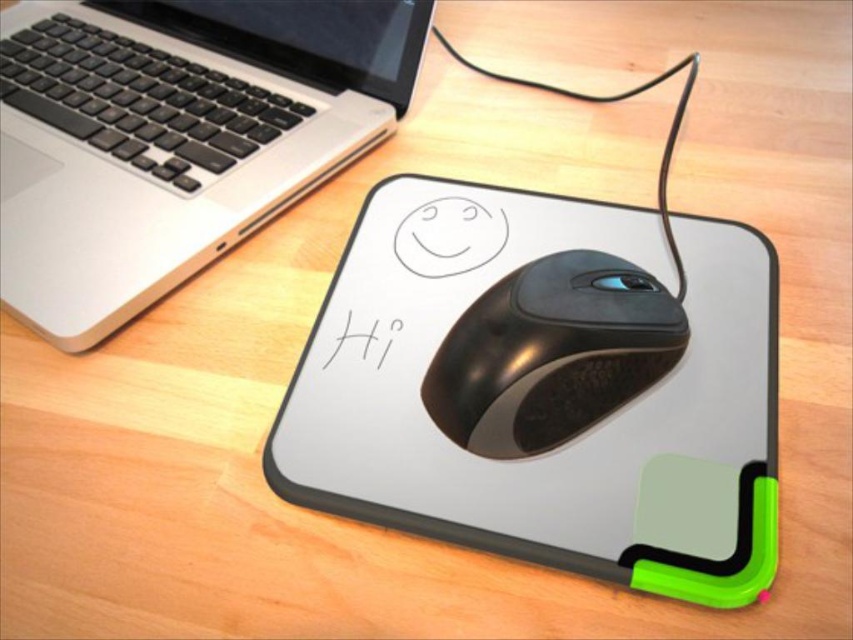
Question: Does white matte mousepad at center have a smaller size compared to satin silver laptop at upper left?

Choices:
 (A) yes
 (B) no

Answer: (A)

Question: Which object is positioned farthest from the white matte mousepad at center?

Choices:
 (A) satin silver laptop at upper left
 (B) black matte mouse at center

Answer: (A)

Question: Does white matte mousepad at center have a lesser width compared to black matte mouse at center?

Choices:
 (A) no
 (B) yes

Answer: (A)

Question: Which point is farther to the camera?

Choices:
 (A) satin silver laptop at upper left
 (B) white matte mousepad at center
 (C) black matte mouse at center

Answer: (A)

Question: Which point is farther to the camera?

Choices:
 (A) black matte mouse at center
 (B) satin silver laptop at upper left
 (C) white matte mousepad at center

Answer: (B)

Question: Observing the image, what is the correct spatial positioning of white matte mousepad at center in reference to black matte mouse at center?

Choices:
 (A) right
 (B) left

Answer: (B)